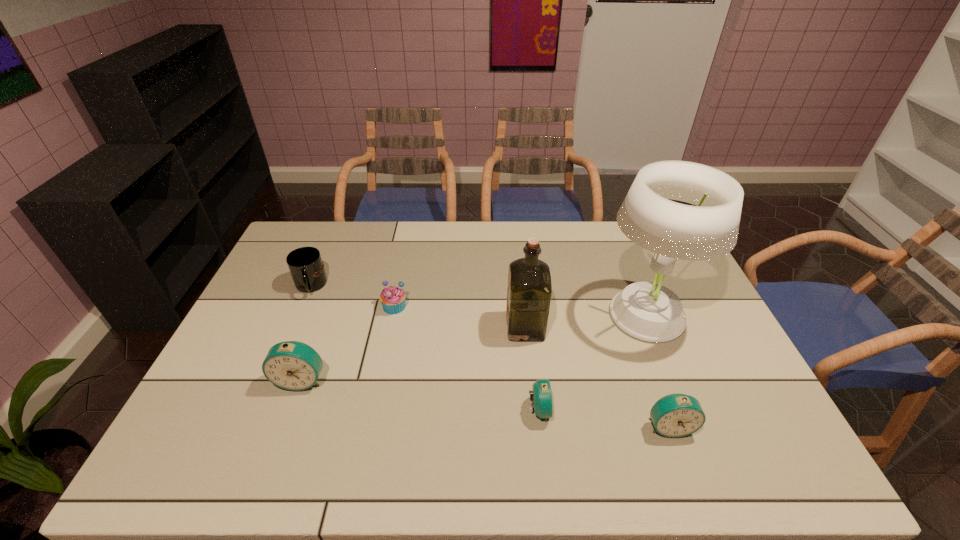
Identify the location of vacant area at the near edge. The height and width of the screenshot is (540, 960). (379, 431).

The image size is (960, 540). I want to click on vacant space at the left edge of the desktop, so [x=251, y=373].

In the image, there is a desktop. In order to click on vacant space at the right edge in this screenshot , I will do `click(703, 306)`.

Identify the location of vacant space at the far left corner of the desktop. This screenshot has height=540, width=960. (305, 239).

You are a GUI agent. You are given a task and a screenshot of the screen. Output one action in this format:
    pyautogui.click(x=<x>, y=<y>)
    Task: Click on the free space at the near left corner
    Image resolution: width=960 pixels, height=540 pixels.
    Given the screenshot: What is the action you would take?
    pyautogui.click(x=209, y=407)

You are a GUI agent. You are given a task and a screenshot of the screen. Output one action in this format:
    pyautogui.click(x=<x>, y=<y>)
    Task: Click on the empty space that is in between the second tallest alarm clock and the second tallest object
    The width and height of the screenshot is (960, 540).
    Given the screenshot: What is the action you would take?
    pyautogui.click(x=597, y=376)

Image resolution: width=960 pixels, height=540 pixels. What are the coordinates of `empty space between the tallest object and the shortest alarm clock` in the screenshot? It's located at (592, 362).

The height and width of the screenshot is (540, 960). Find the location of `free space that is in between the tallest object and the second alarm clock from right to left`. free space that is in between the tallest object and the second alarm clock from right to left is located at coordinates (592, 362).

In order to click on empty space that is in between the sixth shortest object and the third object from left to right in this screenshot , I will do `click(460, 316)`.

Where is `free space between the mug and the liquor`? The width and height of the screenshot is (960, 540). free space between the mug and the liquor is located at coordinates (418, 306).